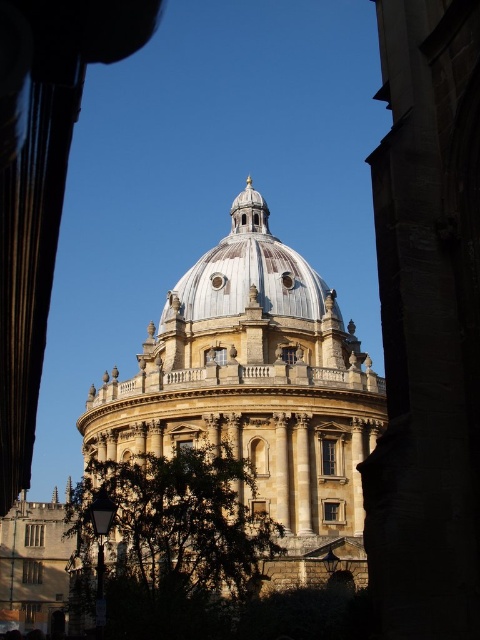
Question: Which point is closer to the camera?

Choices:
 (A) (247, 240)
 (B) (128, 637)

Answer: (B)

Question: Can you confirm if golden stone dome at center is positioned to the right of smooth white dome at center?

Choices:
 (A) yes
 (B) no

Answer: (B)

Question: Which of the following is the farthest from the observer?

Choices:
 (A) (342, 378)
 (B) (296, 273)
 (C) (108, 486)

Answer: (B)

Question: Does golden stone dome at center have a lesser width compared to green leafy tree at lower left?

Choices:
 (A) yes
 (B) no

Answer: (A)

Question: Which of the following is the closest to the observer?

Choices:
 (A) smooth white dome at center
 (B) golden stone dome at center
 (C) green leafy tree at lower left

Answer: (C)

Question: Does golden stone dome at center appear on the left side of green leafy tree at lower left?

Choices:
 (A) yes
 (B) no

Answer: (B)